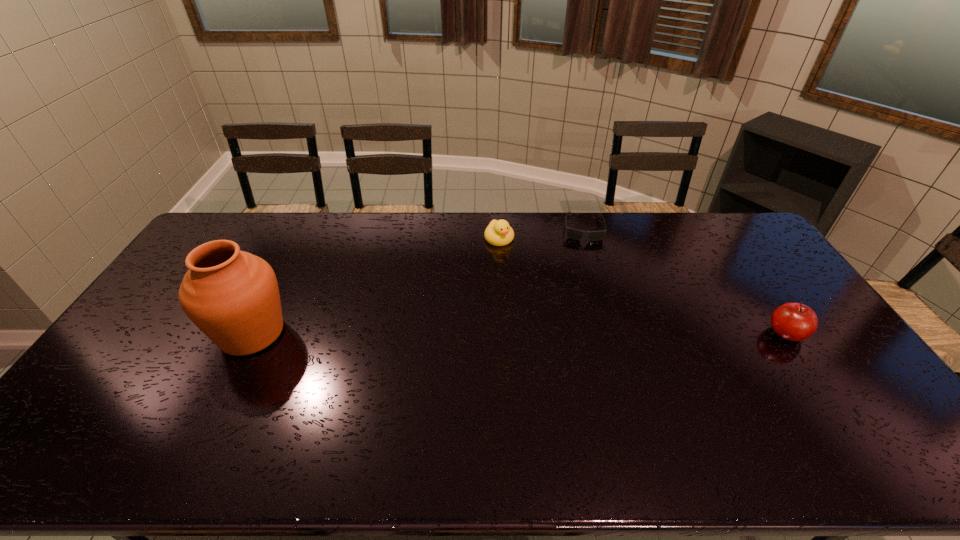
Image resolution: width=960 pixels, height=540 pixels. What are the coordinates of `vacant space at the left edge` in the screenshot? It's located at (162, 295).

Identify the location of free space at the right edge. (733, 263).

Locate an element on the screen. The width and height of the screenshot is (960, 540). free point at the near left corner is located at coordinates (86, 417).

What are the coordinates of `vacant space that's between the shortest object and the leftmost object` in the screenshot? It's located at (418, 280).

Locate an element on the screen. The width and height of the screenshot is (960, 540). blank region between the tallest object and the duckling is located at coordinates (375, 286).

Locate an element on the screen. The image size is (960, 540). vacant space that is in between the sunglasses and the duckling is located at coordinates (540, 233).

Where is `free area in between the sunglasses and the tallest object`? This screenshot has width=960, height=540. free area in between the sunglasses and the tallest object is located at coordinates (418, 280).

The height and width of the screenshot is (540, 960). In order to click on vacant area that lies between the tallest object and the duckling in this screenshot , I will do 375,286.

Find the location of a particular element. This screenshot has width=960, height=540. free space that is in between the apple and the shortest object is located at coordinates (684, 281).

Locate an element on the screen. The image size is (960, 540). free spot between the shortest object and the duckling is located at coordinates (540, 233).